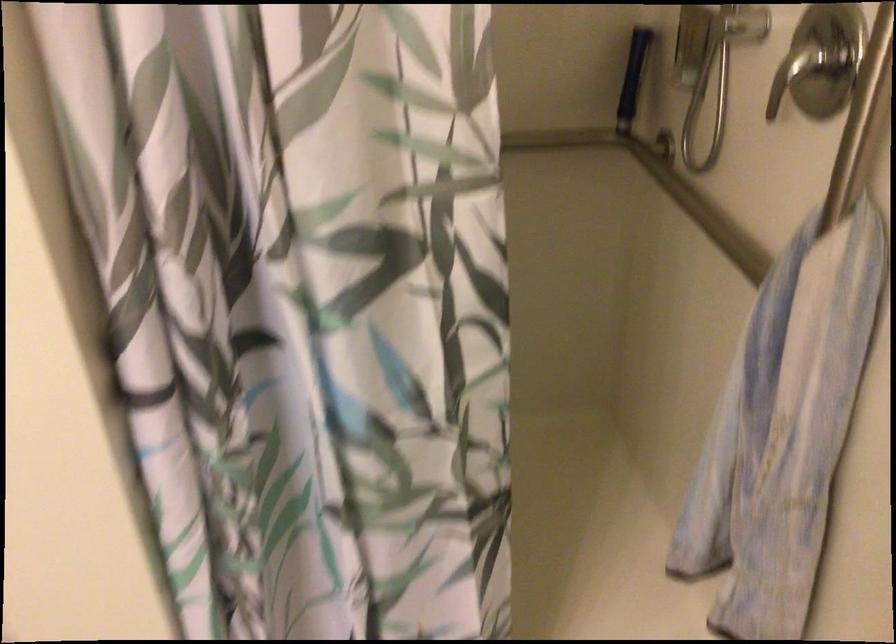
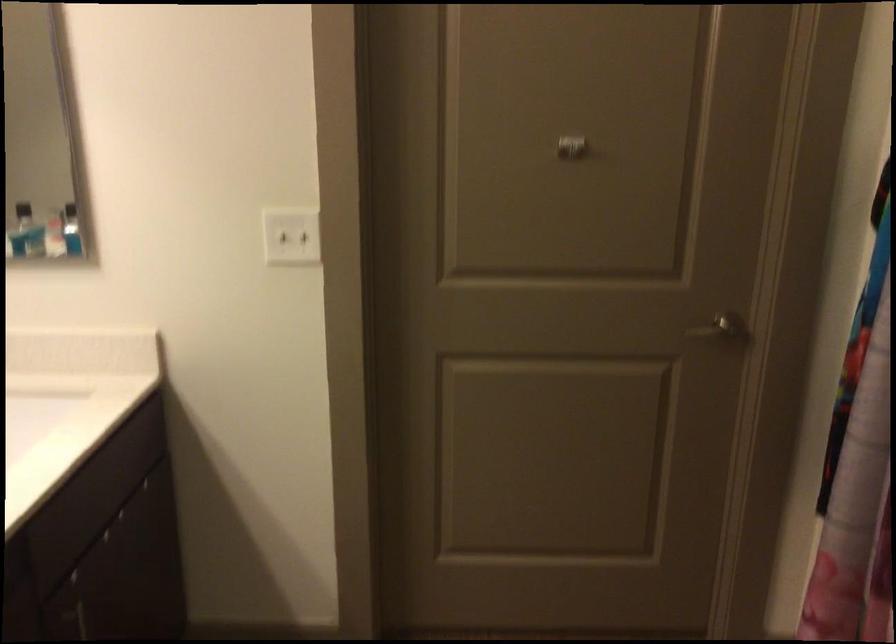
Based on the photo, first-person continuous shooting, in which direction is the camera rotating?

The camera rotated toward left-down.